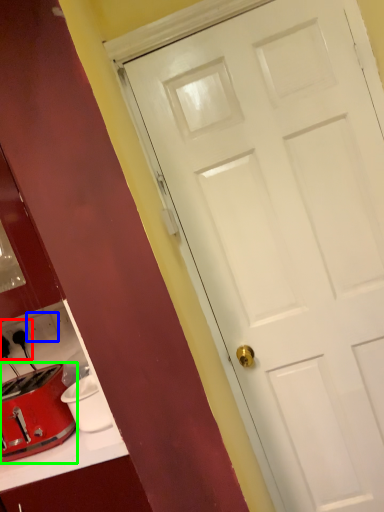
Question: Considering the real-world distances, which object is farthest from electric outlet (highlighted by a red box)? electric outlet (highlighted by a blue box) or toaster (highlighted by a green box)?

Choices:
 (A) electric outlet
 (B) toaster

Answer: (B)